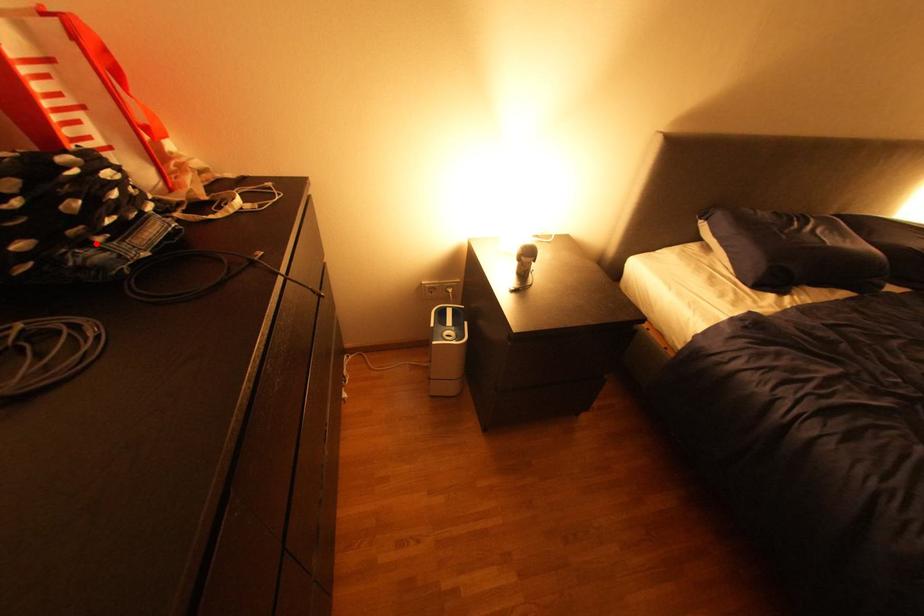
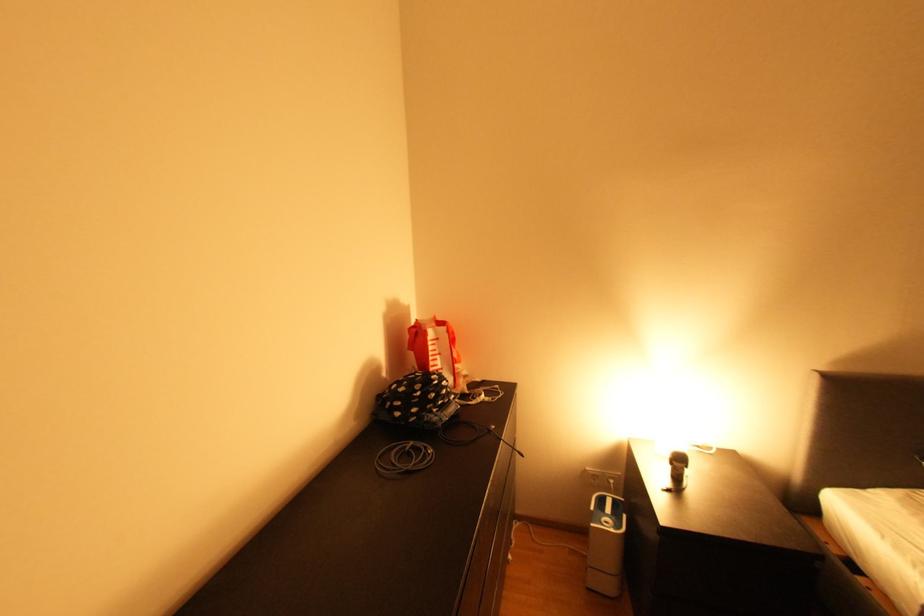
In the second image, find the point that corresponds to the highlighted location in the first image.

(441, 411)